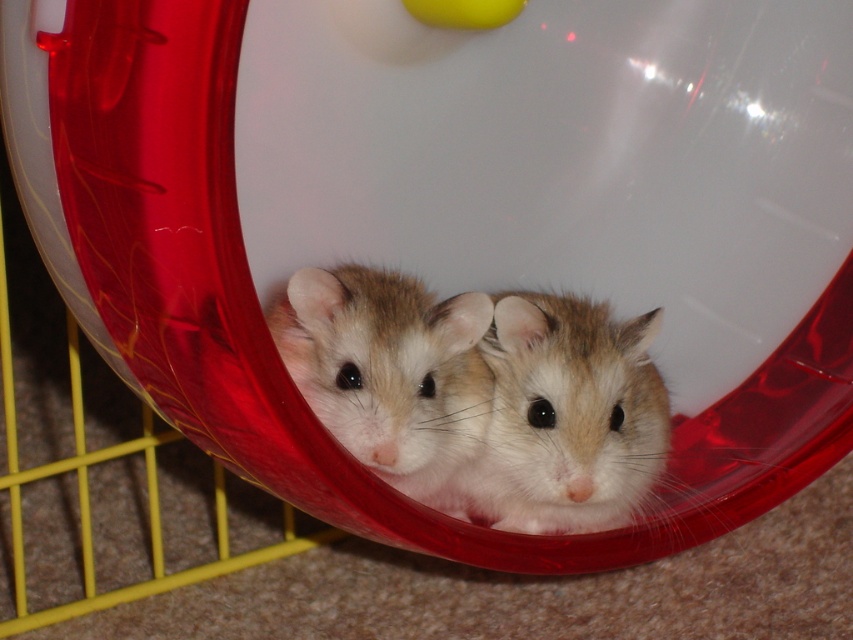
You are a pet owner looking at the hamster enclosure. You see the fuzzy beige mouse at center and the fuzzy beige hamster at center. Which one is positioned to the right?

The fuzzy beige mouse at center is positioned to the right of the fuzzy beige hamster at center.

You are a small toy mouse placed at point [567,417]. You want to move to the red plastic exercise wheel in the enclosure. Is there any obstacle between your current position and the red plastic exercise wheel?

The point [567,417] is on fuzzy beige mouse at center, so there is no obstacle between the fuzzy beige mouse at center and the red plastic exercise wheel in the enclosure.

You are a pet owner observing the enclosure. You notice two small animals at the center. Which one is bigger between the fuzzy beige mouse at center and the fuzzy beige hamster at center?

The fuzzy beige mouse at center is larger in size compared to the fuzzy beige hamster at center according to the description.